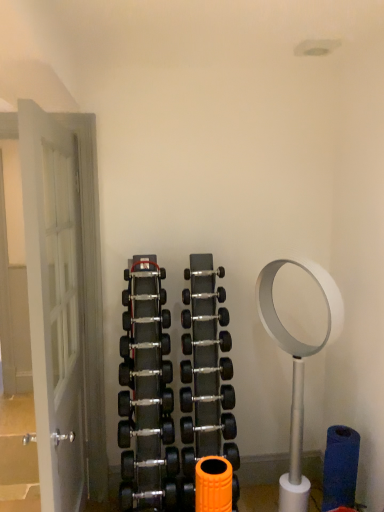
Question: Considering the positions of black rubber dumbbell at center, which ranks as the fifth dumbbell in top-to-bottom order, and black rubber dumbbell at center, the 6th dumbbell viewed from the top, in the image, is black rubber dumbbell at center, which ranks as the fifth dumbbell in top-to-bottom order, wider or thinner than black rubber dumbbell at center, the 6th dumbbell viewed from the top,?

Choices:
 (A) thin
 (B) wide

Answer: (A)

Question: Based on their sizes in the image, would you say black rubber dumbbell at center, which ranks as the fifth dumbbell in top-to-bottom order, is bigger or smaller than black rubber dumbbell at center, the 6th dumbbell viewed from the top?

Choices:
 (A) small
 (B) big

Answer: (A)

Question: Based on their relative distances, which object is nearer to the polished silver dumbbell at center, arranged as the eighth dumbbell when viewed from the top?

Choices:
 (A) silver metallic dumbbell at center, the 8th dumbbell in the bottom-to-top sequence
 (B) black rubber dumbbell at center, arranged as the 2th dumbbell when viewed from the top
 (C) black rubber dumbbell at center, the seventh dumbbell positioned from the bottom
 (D) black rubber dumbbell at center, which is the 11th dumbbell from bottom to top
 (E) black rubber dumbbell at center, the sixth dumbbell from the bottom

Answer: (C)

Question: Which is farther from the black rubber dumbbell at center, the sixth dumbbell from the bottom?

Choices:
 (A) silver metallic dumbbell at center, the 4th dumbbell from the top
 (B) polished silver dumbbell at center, arranged as the eighth dumbbell when viewed from the top
 (C) black rubber dumbbell at center, the seventh dumbbell positioned from the bottom
 (D) black rubber dumbbell at center, the ninth dumbbell positioned from the bottom
 (E) black rubber dumbbell at center, which is the 11th dumbbell from bottom to top

Answer: (E)